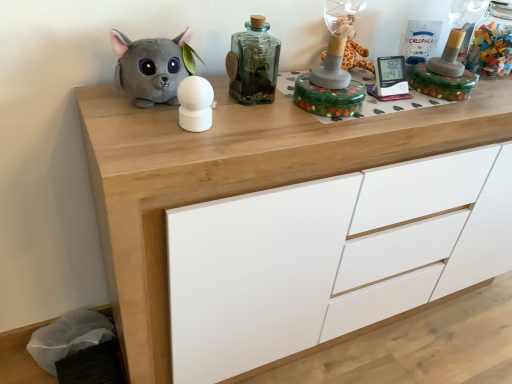
Identify the location of free space in front of green floral box at center, acting as the 1th toy starting from the right. This screenshot has width=512, height=384. (317, 129).